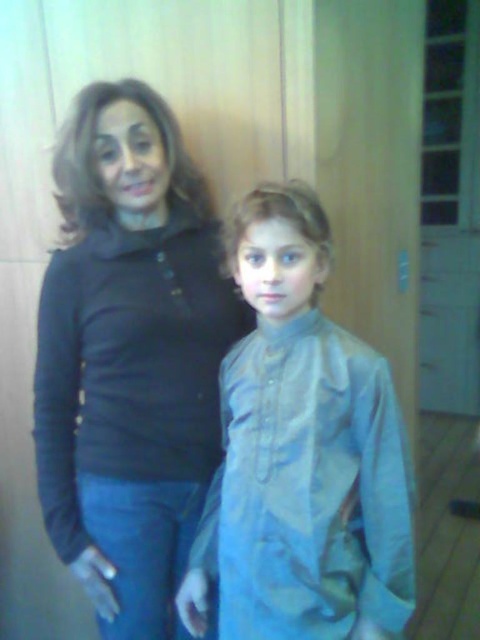
Does matte black turtleneck at upper left have a greater width compared to light blue fabric shirt at center?

Indeed, matte black turtleneck at upper left has a greater width compared to light blue fabric shirt at center.

Does matte black turtleneck at upper left have a larger size compared to light blue fabric shirt at center?

Yes, matte black turtleneck at upper left is bigger than light blue fabric shirt at center.

Who is more distant from viewer, (x=95, y=371) or (x=285, y=237)?

The point (x=95, y=371) is behind.

This screenshot has height=640, width=480. Find the location of `matte black turtleneck at upper left`. matte black turtleneck at upper left is located at coordinates (130, 356).